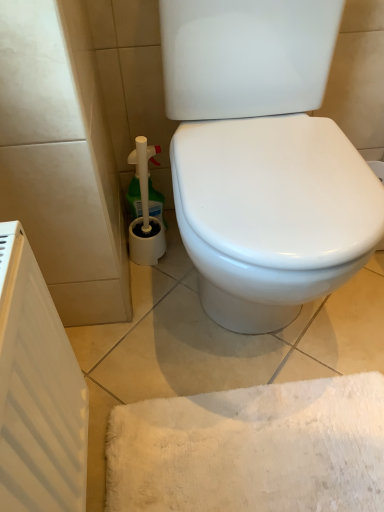
Question: Considering the relative sizes of white matte radiator at left and green plastic cleaner at lower left in the image provided, is white matte radiator at left bigger than green plastic cleaner at lower left?

Choices:
 (A) no
 (B) yes

Answer: (B)

Question: Can you confirm if white matte radiator at left is thinner than green plastic cleaner at lower left?

Choices:
 (A) yes
 (B) no

Answer: (A)

Question: Is the position of white matte radiator at left more distant than that of green plastic cleaner at lower left?

Choices:
 (A) no
 (B) yes

Answer: (A)

Question: Would you say white matte radiator at left is outside green plastic cleaner at lower left?

Choices:
 (A) no
 (B) yes

Answer: (B)

Question: Considering the relative sizes of white matte radiator at left and green plastic cleaner at lower left in the image provided, is white matte radiator at left shorter than green plastic cleaner at lower left?

Choices:
 (A) no
 (B) yes

Answer: (A)

Question: Is white matte radiator at left positioned with its back to green plastic cleaner at lower left?

Choices:
 (A) no
 (B) yes

Answer: (A)

Question: Is green plastic cleaner at lower left bigger than white matte radiator at left?

Choices:
 (A) no
 (B) yes

Answer: (A)

Question: Does green plastic cleaner at lower left have a lesser height compared to white matte radiator at left?

Choices:
 (A) no
 (B) yes

Answer: (B)

Question: Is green plastic cleaner at lower left taller than white matte radiator at left?

Choices:
 (A) no
 (B) yes

Answer: (A)

Question: Does green plastic cleaner at lower left come behind white matte radiator at left?

Choices:
 (A) yes
 (B) no

Answer: (A)

Question: From a real-world perspective, is green plastic cleaner at lower left beneath white matte radiator at left?

Choices:
 (A) yes
 (B) no

Answer: (A)

Question: Is green plastic cleaner at lower left at the left side of white matte radiator at left?

Choices:
 (A) yes
 (B) no

Answer: (B)

Question: Is white matte radiator at left spatially inside green plastic cleaner at lower left, or outside of it?

Choices:
 (A) outside
 (B) inside

Answer: (A)